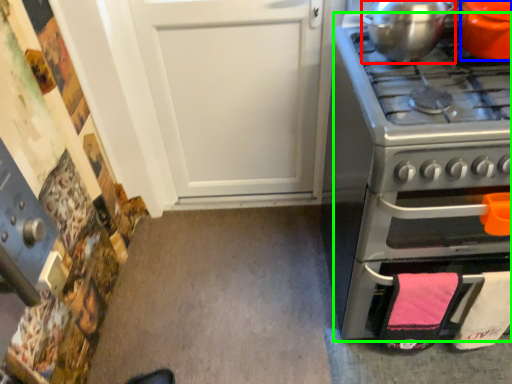
Question: Based on their relative distances, which object is nearer to kitchen appliance (highlighted by a red box)? Choose from kitchen appliance (highlighted by a blue box) and oven (highlighted by a green box).

Choices:
 (A) kitchen appliance
 (B) oven

Answer: (A)